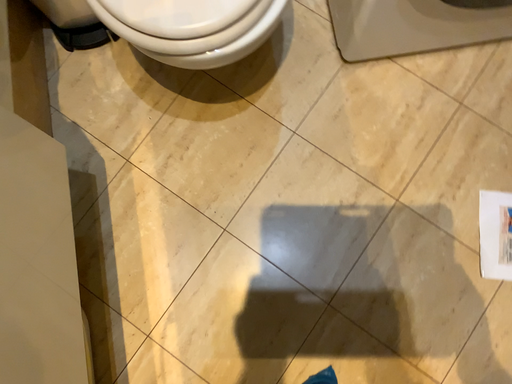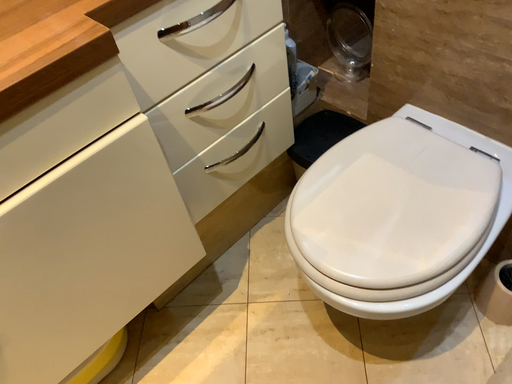
Question: Which way did the camera rotate in the video?

Choices:
 (A) rotated left
 (B) rotated right

Answer: (A)